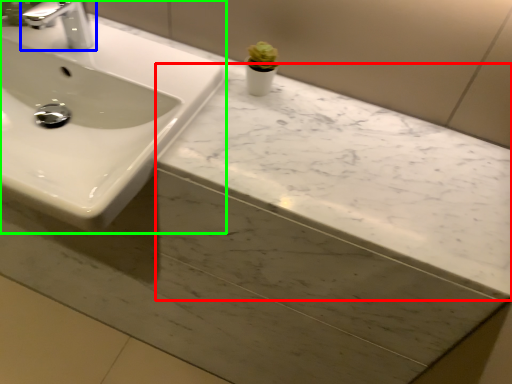
Question: Which object is the closest to the counter top (highlighted by a red box)? Choose among these: tap (highlighted by a blue box) or sink (highlighted by a green box).

Choices:
 (A) tap
 (B) sink

Answer: (B)